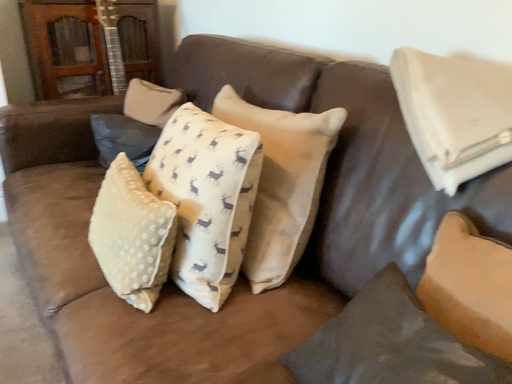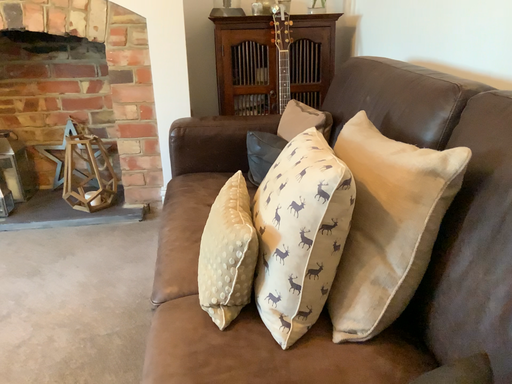
Question: How did the camera likely rotate when shooting the video?

Choices:
 (A) rotated right
 (B) rotated left

Answer: (B)